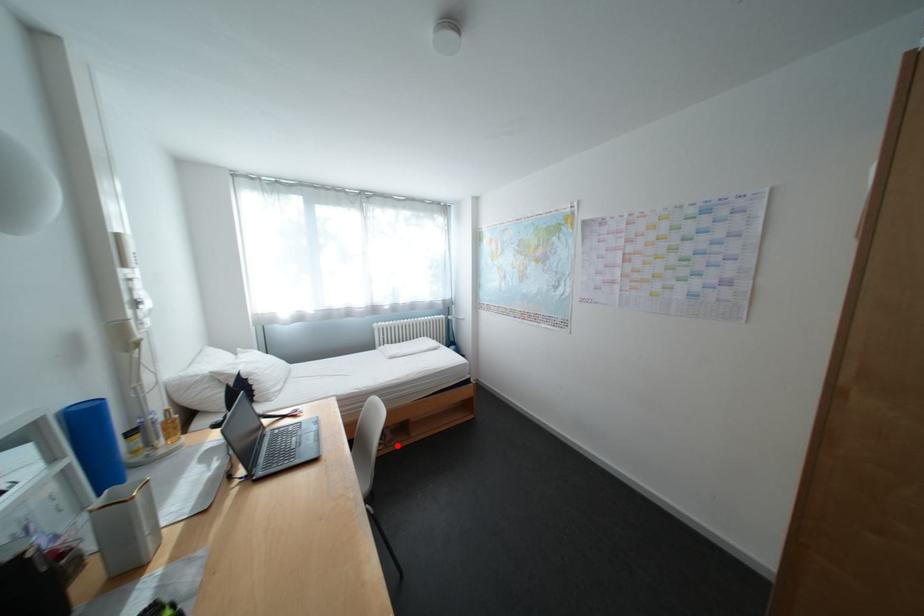
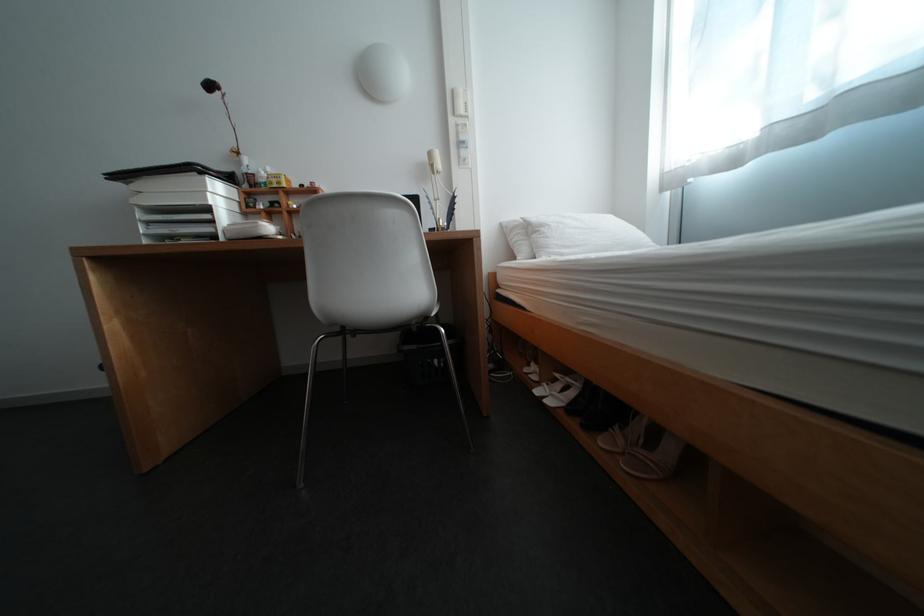
The point at the highlighted location is marked in the first image. Where is the corresponding point in the second image?

(637, 455)